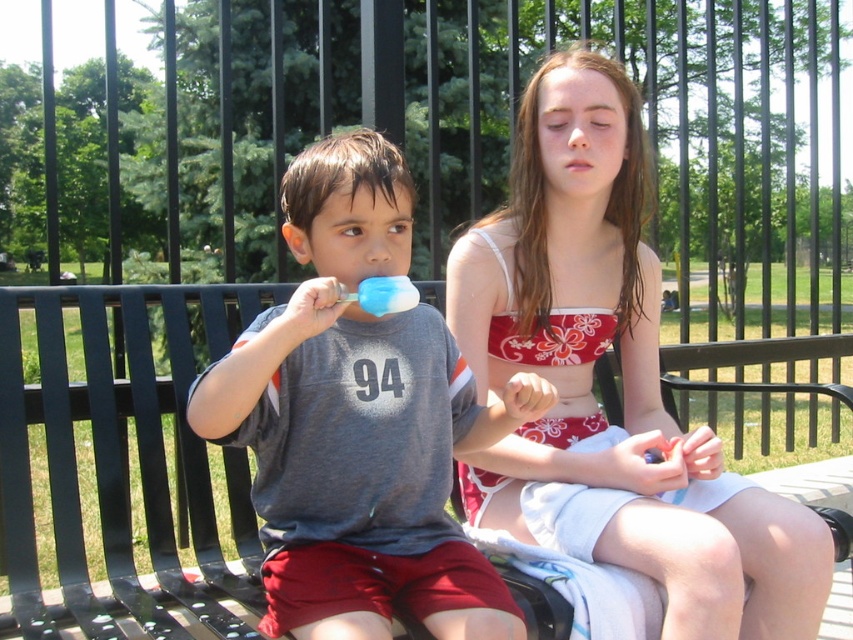
Question: Which object appears closest to the camera in this image?

Choices:
 (A) metallic black bench at center
 (B) red floral tank top at center

Answer: (A)

Question: Observing the image, what is the correct spatial positioning of red floral tank top at center in reference to matte gray t-shirt at center?

Choices:
 (A) left
 (B) right

Answer: (B)

Question: Can you confirm if matte gray t-shirt at center is positioned below metallic black bench at center?

Choices:
 (A) no
 (B) yes

Answer: (A)

Question: Estimate the real-world distances between objects in this image. Which object is closer to the red floral tank top at center?

Choices:
 (A) metallic black bench at center
 (B) matte gray t-shirt at center

Answer: (B)

Question: Considering the real-world distances, which object is closest to the matte gray t-shirt at center?

Choices:
 (A) metallic black bench at center
 (B) red floral tank top at center

Answer: (A)

Question: Does red floral tank top at center appear over metallic black bench at center?

Choices:
 (A) yes
 (B) no

Answer: (A)